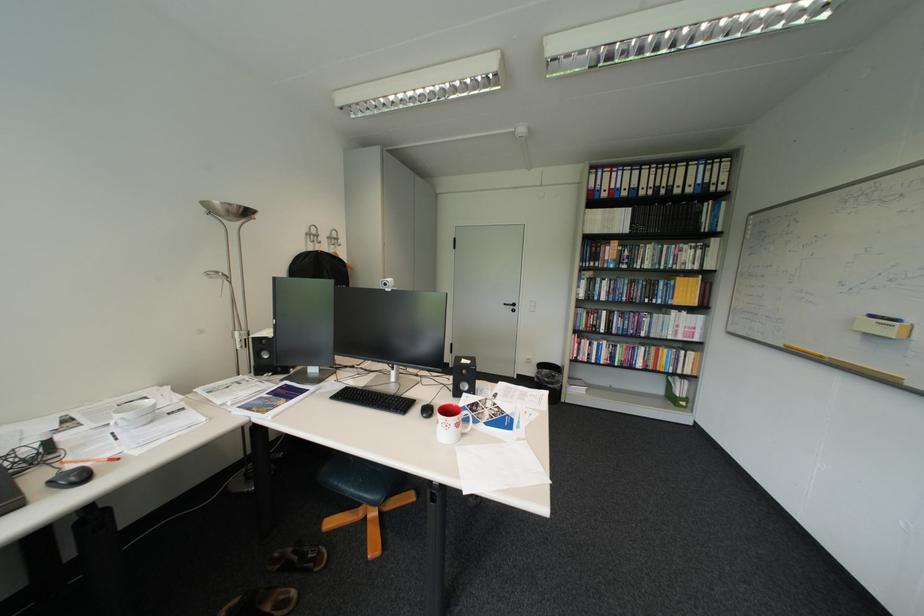
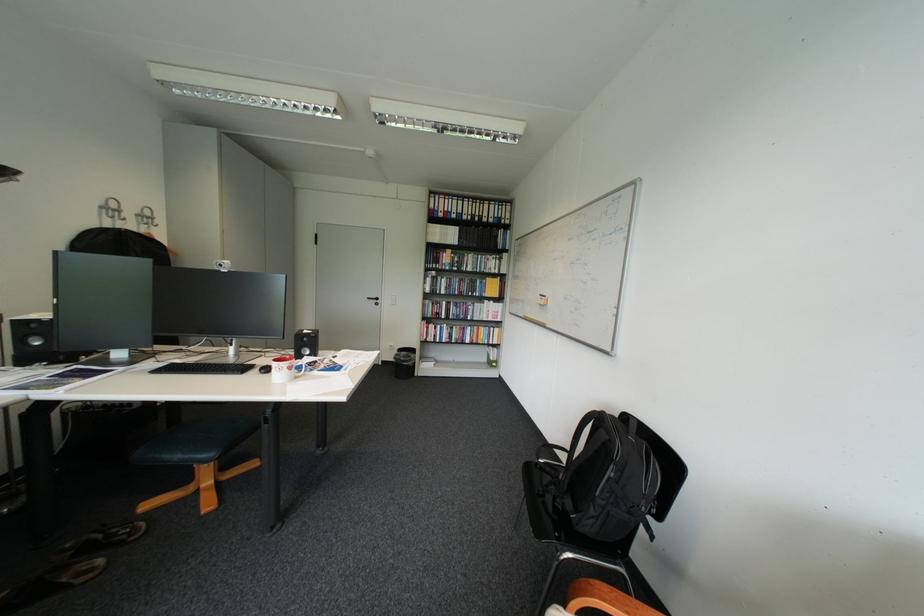
Locate, in the second image, the point that corresponds to the point at 319,235 in the first image.

(114, 208)